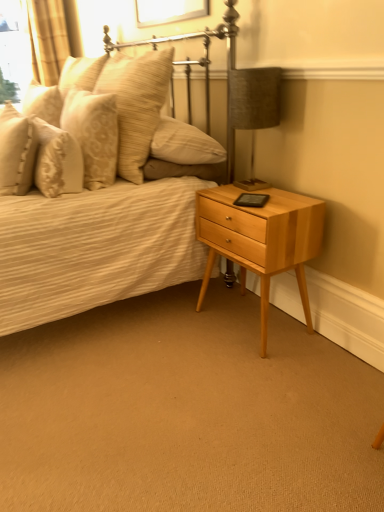
This screenshot has height=512, width=384. I want to click on matte beige bed at center, so click(x=107, y=196).

Measure the distance between patterned fabric pillow at upper left, placed as the second pillow when sorted from right to left, and camera.

The depth of patterned fabric pillow at upper left, placed as the second pillow when sorted from right to left, is 5.75 feet.

Describe the element at coordinates (261, 239) in the screenshot. The width and height of the screenshot is (384, 512). I see `light wood/finely finished nightstand at lower right` at that location.

Identify the location of light wood/finely finished nightstand at lower right. (261, 239).

What is the approximate height of soft beige pillow at upper left, which is the first pillow from right to left?

The height of soft beige pillow at upper left, which is the first pillow from right to left, is 23.75 inches.

The image size is (384, 512). I want to click on matte beige bed at center, so click(x=107, y=196).

Relative to beige textured pillow at left, acting as the 2th pillow starting from the left, is matte beige bed at center in front or behind?

Clearly, matte beige bed at center is in front of beige textured pillow at left, acting as the 2th pillow starting from the left.

From the picture: Is matte beige bed at center located outside beige textured pillow at left, which appears as the third pillow when viewed from the right?

Yes, matte beige bed at center is not within beige textured pillow at left, which appears as the third pillow when viewed from the right.

From a real-world perspective, is matte beige bed at center above or below beige textured pillow at left, acting as the 2th pillow starting from the left?

Clearly, from a real-world perspective, matte beige bed at center is below beige textured pillow at left, acting as the 2th pillow starting from the left.

Is point (7, 113) closer or farther from the camera than point (238, 101)?

Clearly, point (7, 113) is more distant from the camera than point (238, 101).

In the image, is beige textured pillow at left, acting as the 2th pillow starting from the left, positioned in front of or behind textured fabric lampshade at upper right?

In the image, beige textured pillow at left, acting as the 2th pillow starting from the left, appears in front of textured fabric lampshade at upper right.

At what (x,y) coordinates should I click in order to perform the action: click on the 3rd pillow counting from the left side of the textured fabric lampshade at upper right. Please return your answer as a coordinate pair (x, y). This screenshot has height=512, width=384. Looking at the image, I should click on (16, 151).

Which is more to the right, beige textured pillow at left, which appears as the third pillow when viewed from the right, or textured fabric lampshade at upper right?

textured fabric lampshade at upper right.

The image size is (384, 512). There is a light wood/finely finished nightstand at lower right. What are the coordinates of `the 2nd pillow above it (from the image's perspective)` in the screenshot? It's located at [x=93, y=134].

Is point (76, 140) closer to viewer compared to point (249, 261)?

No, it is behind (249, 261).

Looking at this image, considering their positions, is patterned fabric pillow at upper left, placed as the second pillow when sorted from right to left, located in front of or behind light wood/finely finished nightstand at lower right?

Clearly, patterned fabric pillow at upper left, placed as the second pillow when sorted from right to left, is behind light wood/finely finished nightstand at lower right.

Does patterned fabric pillow at upper left, the third pillow positioned from the left, touch light wood/finely finished nightstand at lower right?

No, patterned fabric pillow at upper left, the third pillow positioned from the left, is not in contact with light wood/finely finished nightstand at lower right.

From the image's perspective, who appears lower, golden textured curtain at upper left or soft beige pillow at upper left, positioned as the fourth pillow in left-to-right order?

soft beige pillow at upper left, positioned as the fourth pillow in left-to-right order.

Relative to soft beige pillow at upper left, positioned as the fourth pillow in left-to-right order, is golden textured curtain at upper left in front or behind?

golden textured curtain at upper left is behind soft beige pillow at upper left, positioned as the fourth pillow in left-to-right order.

Is golden textured curtain at upper left beside soft beige pillow at upper left, which is the first pillow from right to left?

No, golden textured curtain at upper left is not in contact with soft beige pillow at upper left, which is the first pillow from right to left.

How distant is golden textured curtain at upper left from soft beige pillow at upper left, which is the first pillow from right to left?

golden textured curtain at upper left and soft beige pillow at upper left, which is the first pillow from right to left, are 6.59 feet apart.

Is soft beige pillow at upper left, positioned as the fourth pillow in left-to-right order, positioned with its back to golden textured curtain at upper left?

No, soft beige pillow at upper left, positioned as the fourth pillow in left-to-right order,'s orientation is not away from golden textured curtain at upper left.

Locate an element on the screen. curtain behind the soft beige pillow at upper left, positioned as the fourth pillow in left-to-right order is located at coordinates (51, 37).

Between soft beige pillow at upper left, which is the first pillow from right to left, and golden textured curtain at upper left, which one has more height?

Standing taller between the two is golden textured curtain at upper left.

Considering the relative sizes of soft beige pillow at upper left, which is the first pillow from right to left, and golden textured curtain at upper left in the image provided, is soft beige pillow at upper left, which is the first pillow from right to left, bigger than golden textured curtain at upper left?

Incorrect, soft beige pillow at upper left, which is the first pillow from right to left, is not larger than golden textured curtain at upper left.

Is patterned fabric pillow at upper left, placed as the second pillow when sorted from right to left, far from textured fabric lampshade at upper right?

No.

Choose the correct answer: Is patterned fabric pillow at upper left, placed as the second pillow when sorted from right to left, inside textured fabric lampshade at upper right or outside it?

patterned fabric pillow at upper left, placed as the second pillow when sorted from right to left, is not inside textured fabric lampshade at upper right, it's outside.

This screenshot has height=512, width=384. What are the coordinates of `bedside lamp in front of the patterned fabric pillow at upper left, the third pillow positioned from the left` in the screenshot? It's located at (251, 112).

From the image's perspective, which one is positioned higher, matte beige pillow at upper left, which appears as the fourth pillow when viewed from the right, or patterned fabric pillow at upper left, placed as the second pillow when sorted from right to left?

matte beige pillow at upper left, which appears as the fourth pillow when viewed from the right, from the image's perspective.

You are a GUI agent. You are given a task and a screenshot of the screen. Output one action in this format:
    pyautogui.click(x=<x>, y=<y>)
    Task: Click on the 2nd pillow above the patterned fabric pillow at upper left, the third pillow positioned from the left (from the image's perspective)
    
    Given the screenshot: What is the action you would take?
    pyautogui.click(x=43, y=103)

Considering the relative sizes of matte beige pillow at upper left, which appears as the fourth pillow when viewed from the right, and patterned fabric pillow at upper left, placed as the second pillow when sorted from right to left, in the image provided, is matte beige pillow at upper left, which appears as the fourth pillow when viewed from the right, shorter than patterned fabric pillow at upper left, placed as the second pillow when sorted from right to left,?

Indeed, matte beige pillow at upper left, which appears as the fourth pillow when viewed from the right, has a lesser height compared to patterned fabric pillow at upper left, placed as the second pillow when sorted from right to left.

Considering the positions of objects matte beige pillow at upper left, which appears as the fourth pillow when viewed from the right, and patterned fabric pillow at upper left, placed as the second pillow when sorted from right to left, in the image provided, who is behind, matte beige pillow at upper left, which appears as the fourth pillow when viewed from the right, or patterned fabric pillow at upper left, placed as the second pillow when sorted from right to left,?

Positioned behind is matte beige pillow at upper left, which appears as the fourth pillow when viewed from the right.

Which pillow is the 1st one when counting from the back of the matte beige bed at center? Please provide its 2D coordinates.

[(16, 151)]

At what (x,y) coordinates should I click in order to perform the action: click on bedside lamp located above the beige textured pillow at left, acting as the 2th pillow starting from the left (from a real-world perspective). Please return your answer as a coordinate pair (x, y). The image size is (384, 512). Looking at the image, I should click on (x=251, y=112).

Looking at the image, which one is located closer to soft beige pillow at upper left, which is the first pillow from right to left, golden textured curtain at upper left or patterned fabric pillow at upper left, the third pillow positioned from the left?

patterned fabric pillow at upper left, the third pillow positioned from the left, lies closer to soft beige pillow at upper left, which is the first pillow from right to left, than the other object.

Considering their positions, is matte beige bed at center positioned further to light wood/finely finished nightstand at lower right than golden textured curtain at upper left?

golden textured curtain at upper left is positioned further to the anchor light wood/finely finished nightstand at lower right.

Looking at the image, which one is located further to matte beige pillow at upper left, the first pillow viewed from the left, light wood/finely finished nightstand at lower right or patterned fabric pillow at upper left, placed as the second pillow when sorted from right to left?

Among the two, light wood/finely finished nightstand at lower right is located further to matte beige pillow at upper left, the first pillow viewed from the left.

Considering their positions, is light wood/finely finished nightstand at lower right positioned closer to matte beige bed at center than beige textured pillow at left, acting as the 2th pillow starting from the left?

Among the two, beige textured pillow at left, acting as the 2th pillow starting from the left, is located nearer to matte beige bed at center.

When comparing their distances from beige textured pillow at left, acting as the 2th pillow starting from the left, does light wood/finely finished nightstand at lower right or matte beige pillow at upper left, the first pillow viewed from the left, seem further?

light wood/finely finished nightstand at lower right is positioned further to the anchor beige textured pillow at left, acting as the 2th pillow starting from the left.

When comparing their distances from light wood/finely finished nightstand at lower right, does textured fabric lampshade at upper right or golden textured curtain at upper left seem further?

golden textured curtain at upper left.

Looking at the image, which one is located further to beige textured pillow at left, which appears as the third pillow when viewed from the right, matte beige bed at center or golden textured curtain at upper left?

golden textured curtain at upper left.

Which object lies nearer to the anchor point light wood/finely finished nightstand at lower right, patterned fabric pillow at upper left, placed as the second pillow when sorted from right to left, or matte beige bed at center?

matte beige bed at center is closer to light wood/finely finished nightstand at lower right.

Identify the location of pillow situated between patterned fabric pillow at upper left, the third pillow positioned from the left, and textured fabric lampshade at upper right from left to right. (136, 104).

This screenshot has width=384, height=512. Identify the location of bed between matte beige pillow at upper left, which appears as the fourth pillow when viewed from the right, and light wood/finely finished nightstand at lower right from left to right. (107, 196).

Image resolution: width=384 pixels, height=512 pixels. What are the coordinates of `bedside lamp between matte beige pillow at upper left, which appears as the fourth pillow when viewed from the right, and light wood/finely finished nightstand at lower right` in the screenshot? It's located at (251, 112).

Identify the location of bed situated between matte beige pillow at upper left, the first pillow viewed from the left, and textured fabric lampshade at upper right from left to right. (107, 196).